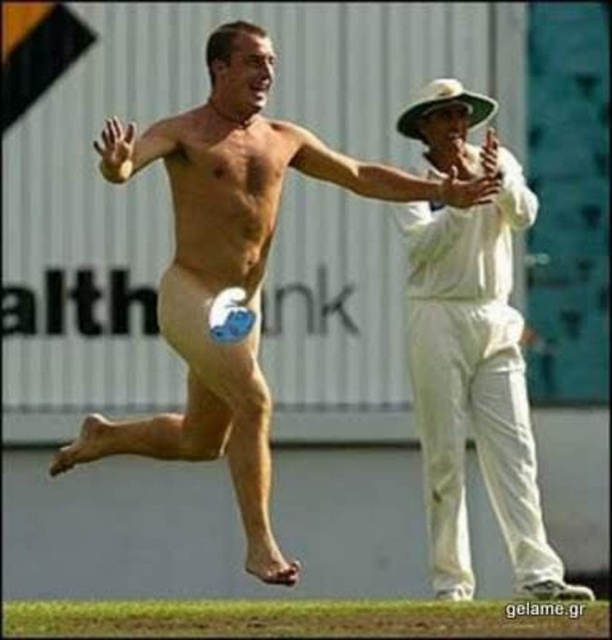
Question: Which point is farther to the camera?

Choices:
 (A) (70, 449)
 (B) (460, 488)

Answer: (B)

Question: Is skinny nude man at center further to camera compared to white cotton cricket uniform at right?

Choices:
 (A) yes
 (B) no

Answer: (B)

Question: Which object is closer to the camera taking this photo?

Choices:
 (A) skinny nude man at center
 (B) white cotton cricket uniform at right

Answer: (A)

Question: Observing the image, what is the correct spatial positioning of skinny nude man at center in reference to white cotton cricket uniform at right?

Choices:
 (A) right
 (B) left

Answer: (B)

Question: Which object appears closest to the camera in this image?

Choices:
 (A) white cotton cricket uniform at right
 (B) skinny nude man at center

Answer: (B)

Question: Does skinny nude man at center have a larger size compared to white cotton cricket uniform at right?

Choices:
 (A) yes
 (B) no

Answer: (B)